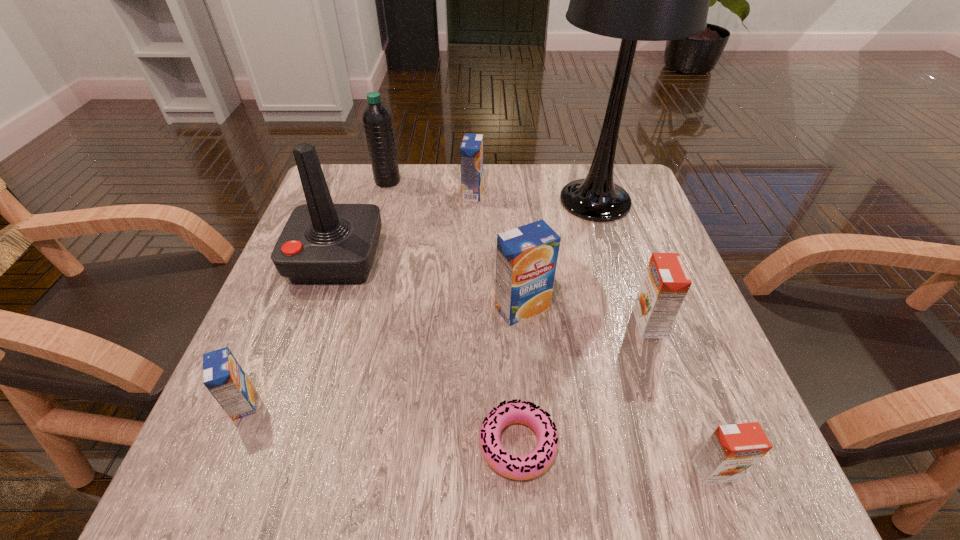
Find the location of a particular element. This screenshot has width=960, height=540. free space between the nearest orange juice and the pink doughnut is located at coordinates (616, 458).

Identify the location of vacant space that is in between the second orange juice from left to right and the doughnut. The width and height of the screenshot is (960, 540). (495, 319).

I want to click on vacant area between the bigger orange orange juice and the biggest blue orange_juice, so click(x=586, y=315).

Locate an element on the screen. The height and width of the screenshot is (540, 960). vacant area that lies between the tallest object and the joystick is located at coordinates (466, 230).

What are the coordinates of `vacant region between the table lamp and the second biggest blue orange_juice` in the screenshot? It's located at (534, 197).

The height and width of the screenshot is (540, 960). What are the coordinates of `free space that is in between the smaller orange orange juice and the nearest blue orange_juice` in the screenshot? It's located at (479, 437).

You are a GUI agent. You are given a task and a screenshot of the screen. Output one action in this format:
    pyautogui.click(x=<x>, y=<y>)
    Task: Click on the free space between the second biggest blue orange_juice and the farther orange orange juice
    The width and height of the screenshot is (960, 540).
    Given the screenshot: What is the action you would take?
    pyautogui.click(x=561, y=258)

The image size is (960, 540). I want to click on free spot between the shortest object and the leftmost orange juice, so click(x=380, y=424).

The image size is (960, 540). I want to click on free space between the black water bottle and the leftmost blue orange_juice, so click(316, 292).

Identify which object is the second closest to the water bottle. Please provide its 2D coordinates. Your answer should be formatted as a tuple, i.e. [(x, y)], where the tuple contains the x and y coordinates of a point satisfying the conditions above.

[(321, 243)]